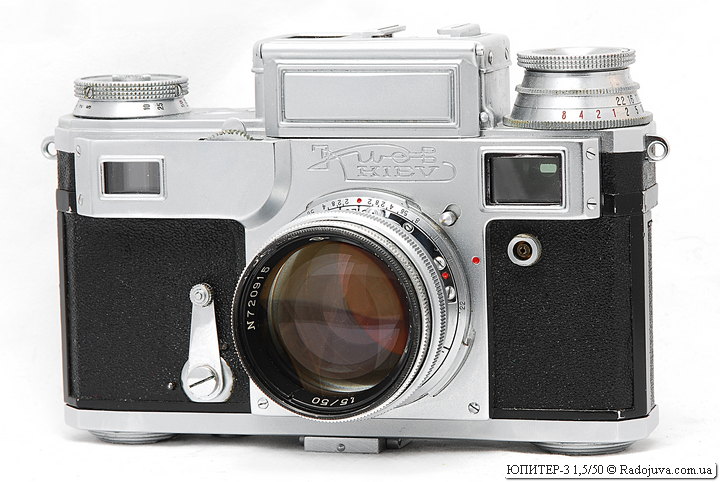
Locate an element on the screen. knob is located at coordinates (577, 60).